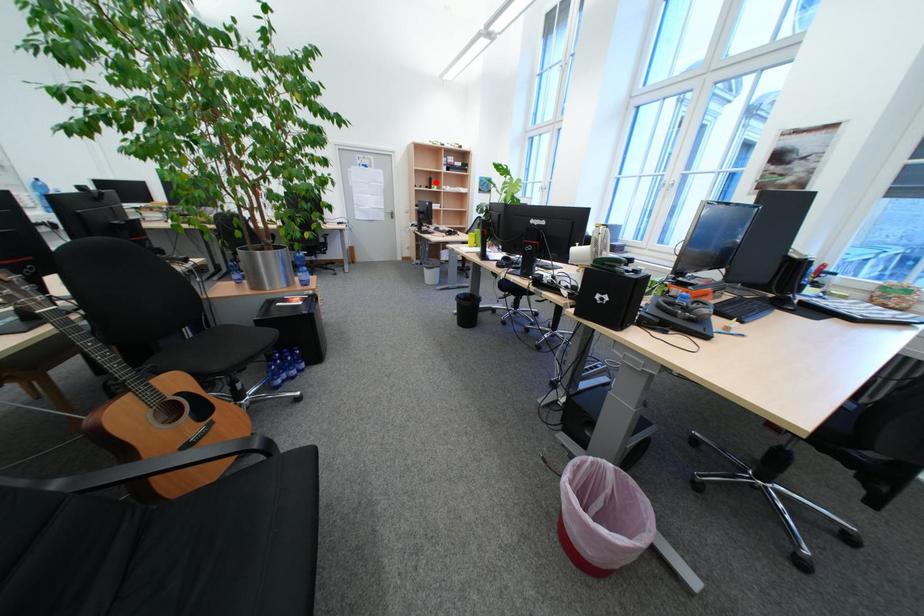
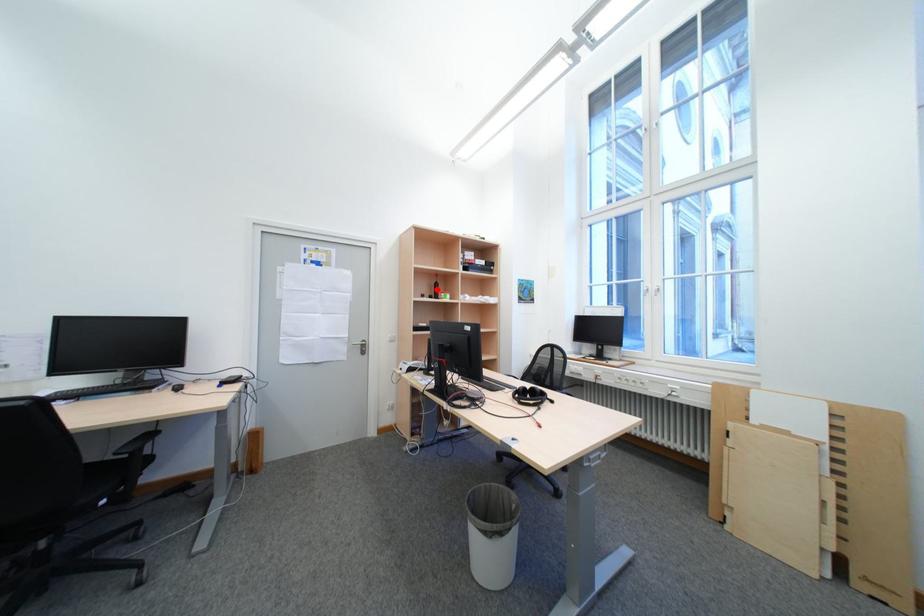
I am providing you with two images of the same scene from different viewpoints. A red point is marked on the first image and another point is marked on the second image. Is the marked point in image1 the same physical position as the marked point in image2?

Yes